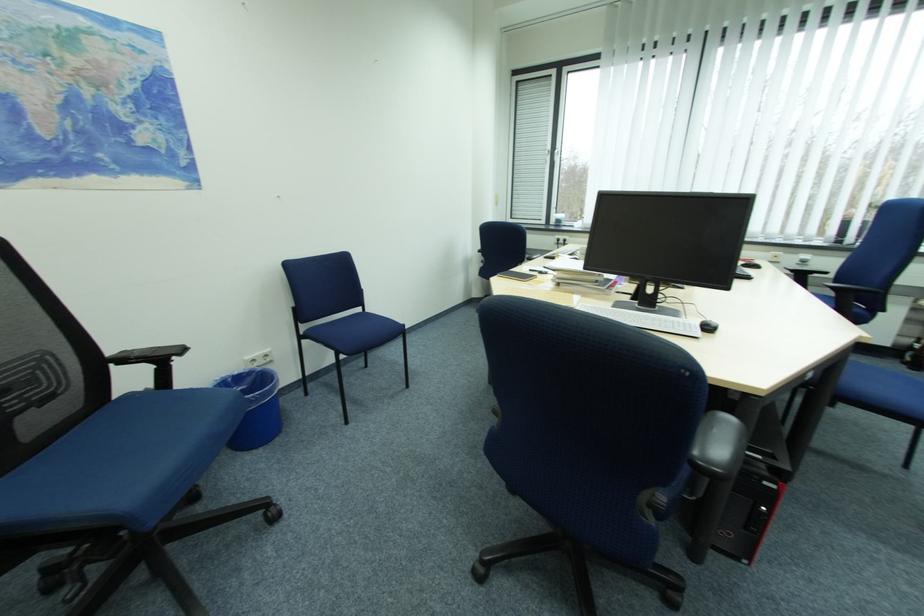
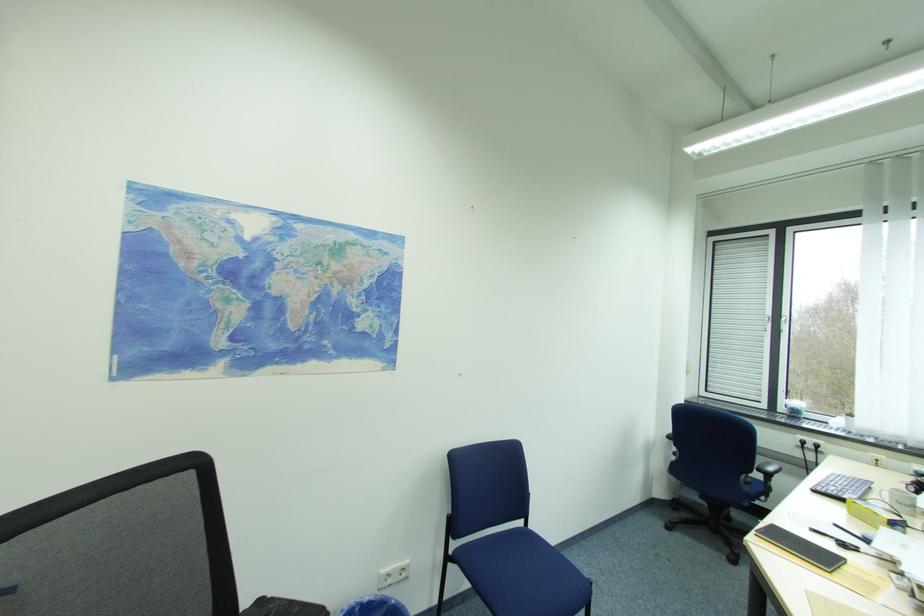
First-person continuous shooting, in which direction is the camera rotating?

The camera rotated toward left-up.